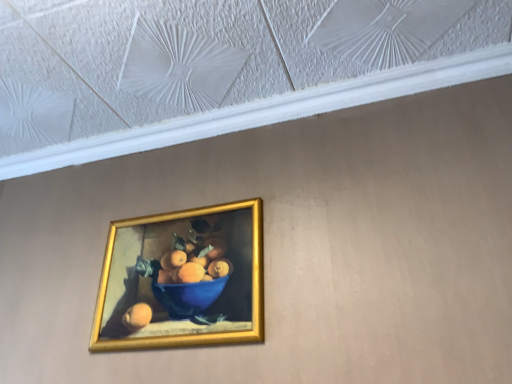
What do you see at coordinates (182, 279) in the screenshot? The image size is (512, 384). I see `gold metallic picture frame at center` at bounding box center [182, 279].

This screenshot has height=384, width=512. Find the location of `gold metallic picture frame at center`. gold metallic picture frame at center is located at coordinates (182, 279).

I want to click on gold metallic picture frame at center, so click(x=182, y=279).